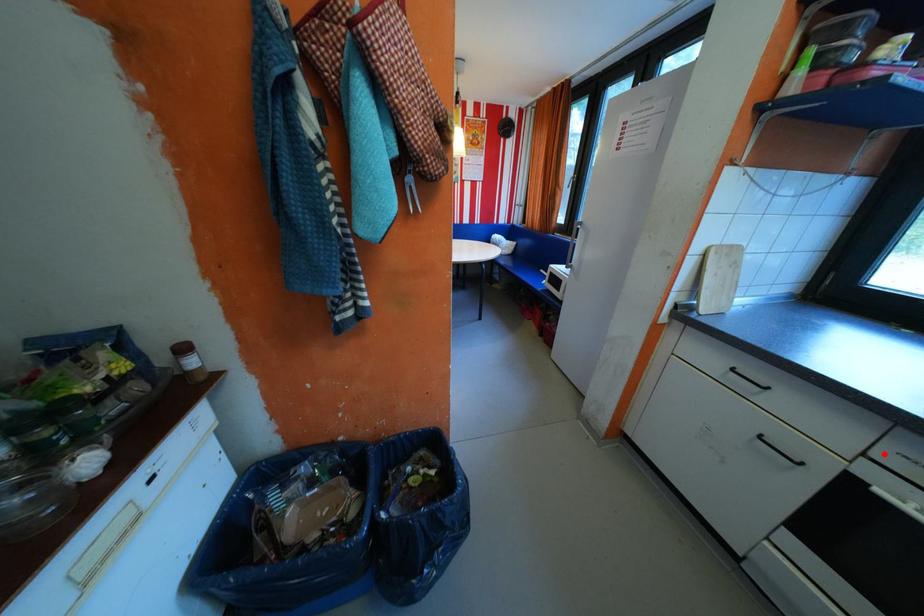
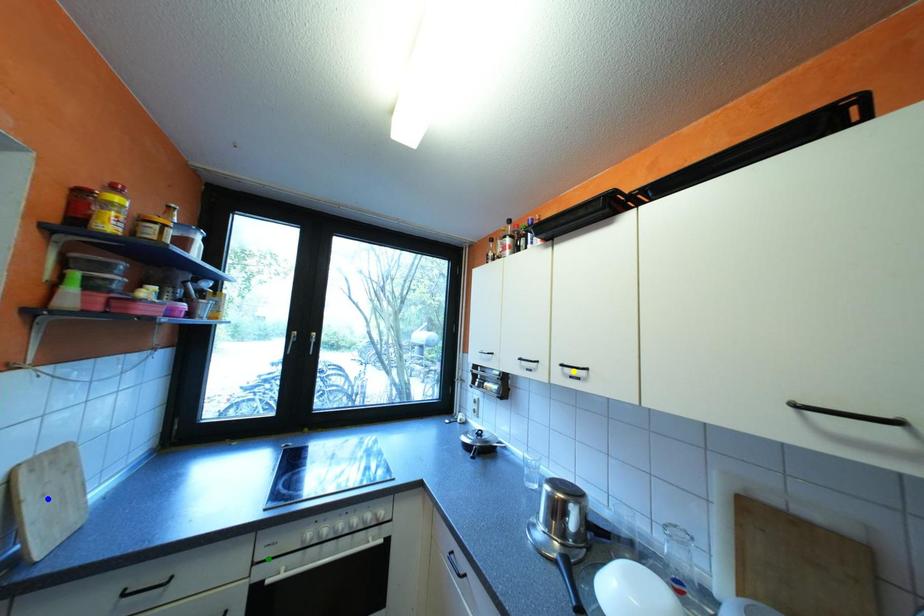
Question: I am providing you with two images of the same scene from different viewpoints. A red point is marked on the first image. You are given multiple points on the second image. Which spot in image 2 lines up with the point in image 1?

Choices:
 (A) blue point
 (B) green point
 (C) yellow point

Answer: (B)